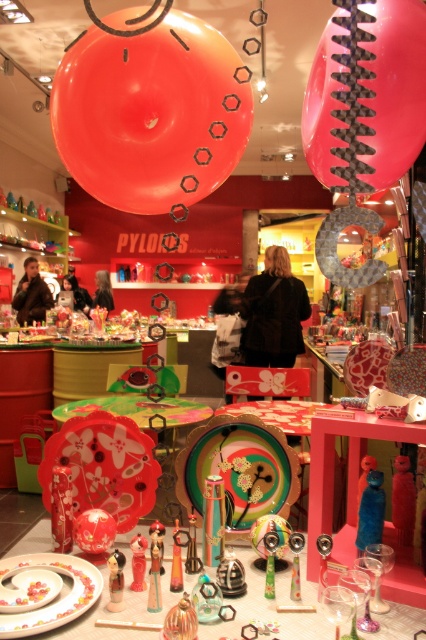
Question: Is translucent glass figurine at center to the left of translucent glass vase at center from the viewer's perspective?

Choices:
 (A) no
 (B) yes

Answer: (B)

Question: Can you confirm if translucent plastic toy at center is wider than blue plastic toy at center?

Choices:
 (A) no
 (B) yes

Answer: (A)

Question: Which point appears closest to the camera in this image?

Choices:
 (A) (325, 484)
 (B) (408, 492)

Answer: (A)

Question: Is matte orange balloon at upper center positioned behind matte black jacket at left?

Choices:
 (A) yes
 (B) no

Answer: (B)

Question: Which of the following is the farthest from the observer?

Choices:
 (A) matte black jacket at left
 (B) matte red vase at center
 (C) matte orange balloon at upper center
 (D) translucent plastic toy at center

Answer: (A)

Question: Among these objects, which one is farthest from the camera?

Choices:
 (A) black fabric bag at center
 (B) matte red candle at center
 (C) matte black hair at center
 (D) translucent glass vase at center

Answer: (C)